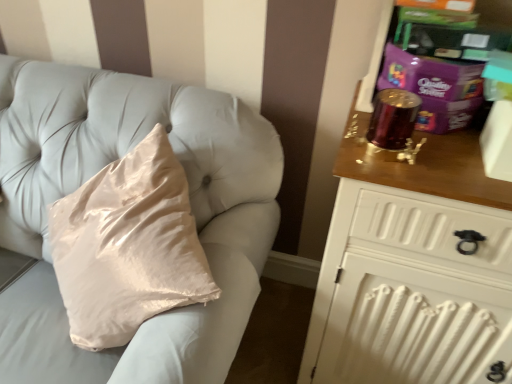
Question: Is wooden chest of drawers at right at the right side of silky beige pillow at upper left?

Choices:
 (A) yes
 (B) no

Answer: (A)

Question: Can you confirm if wooden chest of drawers at right is shorter than silky beige pillow at upper left?

Choices:
 (A) no
 (B) yes

Answer: (A)

Question: Would you say wooden chest of drawers at right is outside silky beige pillow at upper left?

Choices:
 (A) no
 (B) yes

Answer: (B)

Question: From the image's perspective, is wooden chest of drawers at right below silky beige pillow at upper left?

Choices:
 (A) no
 (B) yes

Answer: (B)

Question: Can you confirm if wooden chest of drawers at right is thinner than silky beige pillow at upper left?

Choices:
 (A) yes
 (B) no

Answer: (B)

Question: Is the position of wooden chest of drawers at right less distant than that of silky beige pillow at upper left?

Choices:
 (A) no
 (B) yes

Answer: (B)

Question: Does silky beige pillow at upper left appear on the left side of wooden chest of drawers at right?

Choices:
 (A) no
 (B) yes

Answer: (B)

Question: Is silky beige pillow at upper left oriented towards wooden chest of drawers at right?

Choices:
 (A) no
 (B) yes

Answer: (A)

Question: Is silky beige pillow at upper left smaller than wooden chest of drawers at right?

Choices:
 (A) yes
 (B) no

Answer: (A)

Question: Is silky beige pillow at upper left positioned behind wooden chest of drawers at right?

Choices:
 (A) yes
 (B) no

Answer: (A)

Question: Is silky beige pillow at upper left positioned before wooden chest of drawers at right?

Choices:
 (A) no
 (B) yes

Answer: (A)

Question: Can we say silky beige pillow at upper left lies outside wooden chest of drawers at right?

Choices:
 (A) yes
 (B) no

Answer: (A)

Question: Which is correct: silky beige pillow at upper left is inside wooden chest of drawers at right, or outside of it?

Choices:
 (A) inside
 (B) outside

Answer: (B)